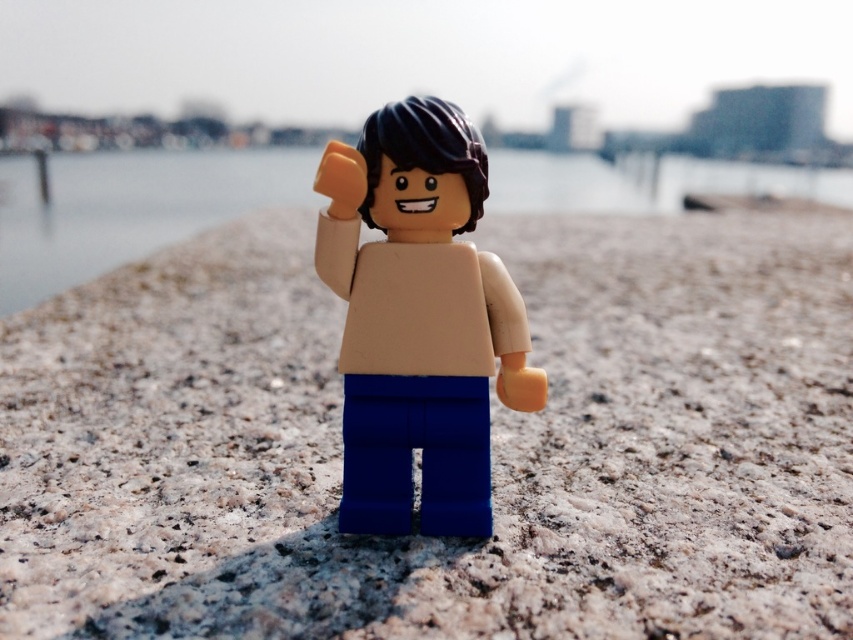
You are a photographer trying to capture the matte plastic minifigure at center on the smooth sand at center. If you want to ensure the minifigure is clearly visible, which object should you focus on and why?

You should focus on the matte plastic minifigure at center because the smooth sand at center is larger in size, making the minifigure appear smaller and potentially less distinct against the larger sand area.

You are a LEGO minifigure standing on a beach. You see two points in front of you. The first point is at coordinate point (764, 452) and the second is at point (422, 180). Which point is closer to you?

Point (422, 180) is closer to you because point (764, 452) is behind it.